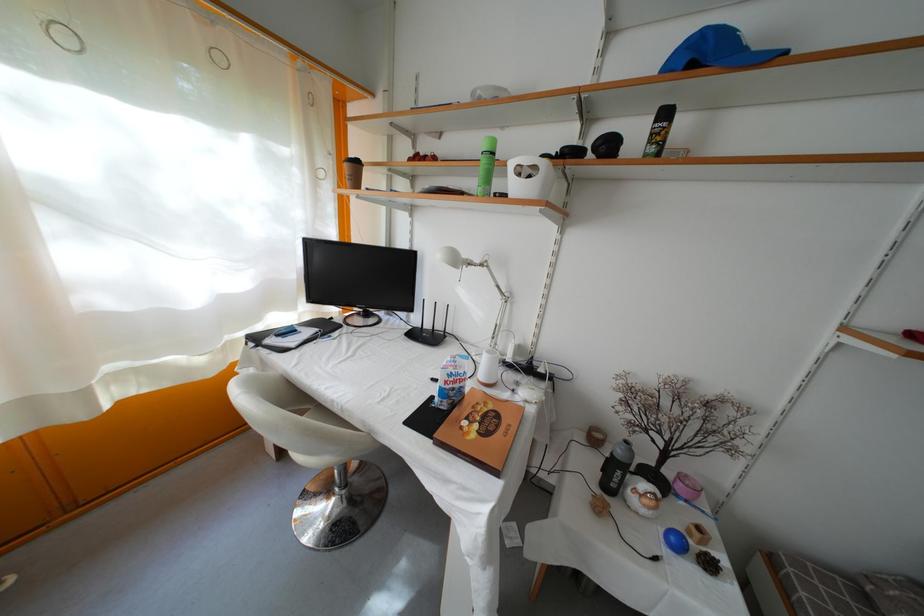
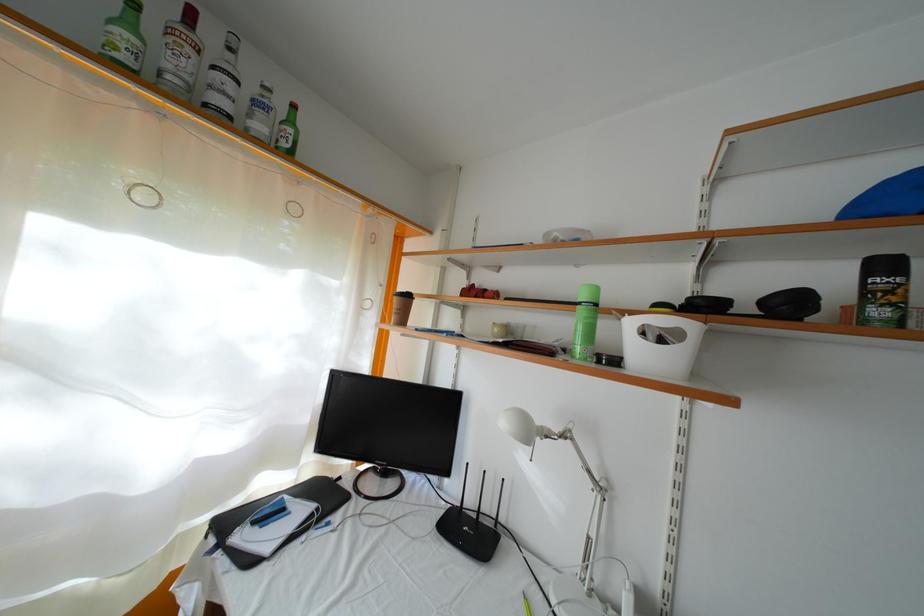
In the second image, find the point that corresponds to point 672,121 in the first image.

(891, 273)